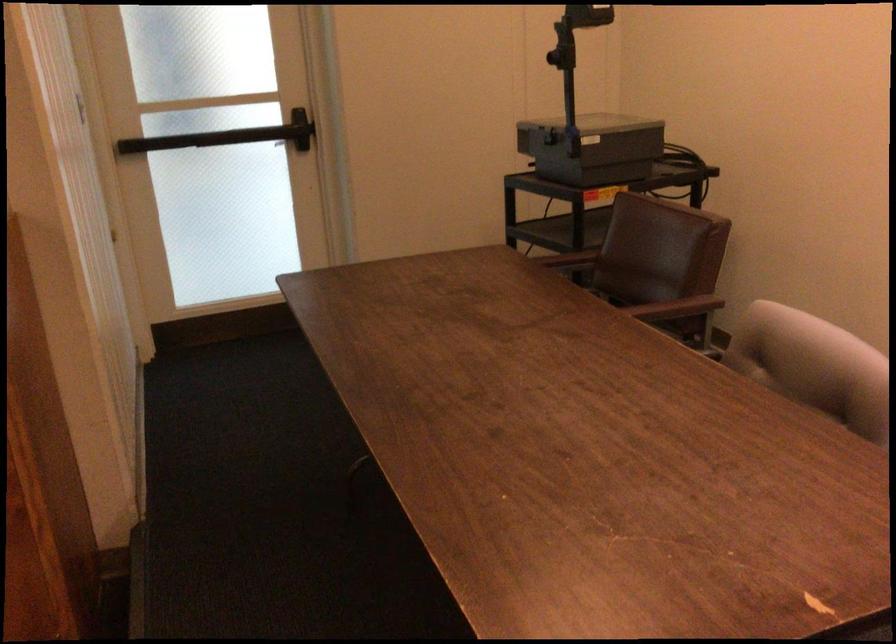
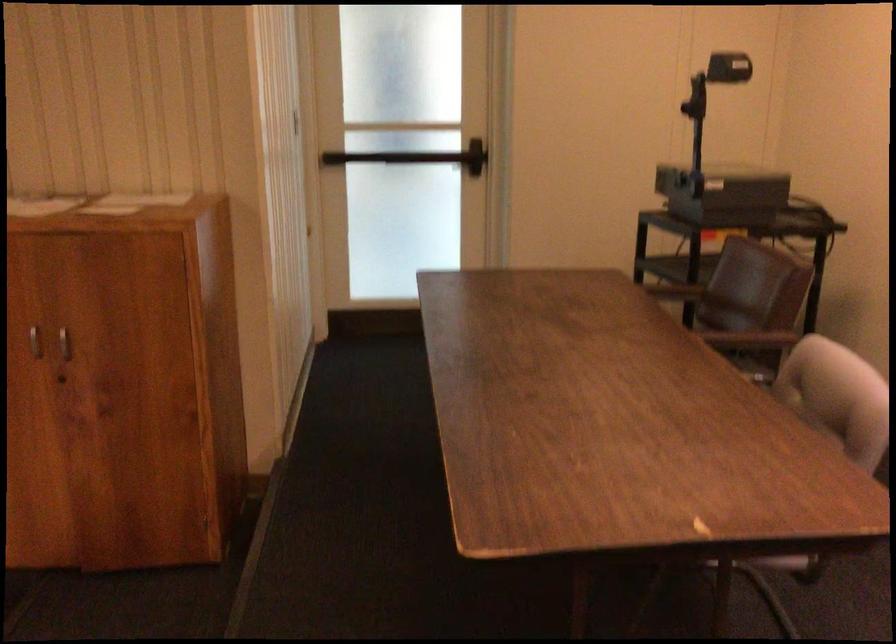
Question: The camera is either moving clockwise (left) or counter-clockwise (right) around the object. The first image is from the beginning of the video and the second image is from the end. Is the camera moving left or right when shooting the video?

Choices:
 (A) Left
 (B) Right

Answer: (B)